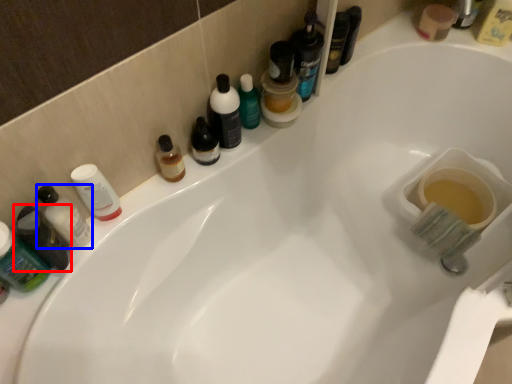
Question: Which object is closer to the camera taking this photo, toiletry (highlighted by a red box) or toiletry (highlighted by a blue box)?

Choices:
 (A) toiletry
 (B) toiletry

Answer: (A)